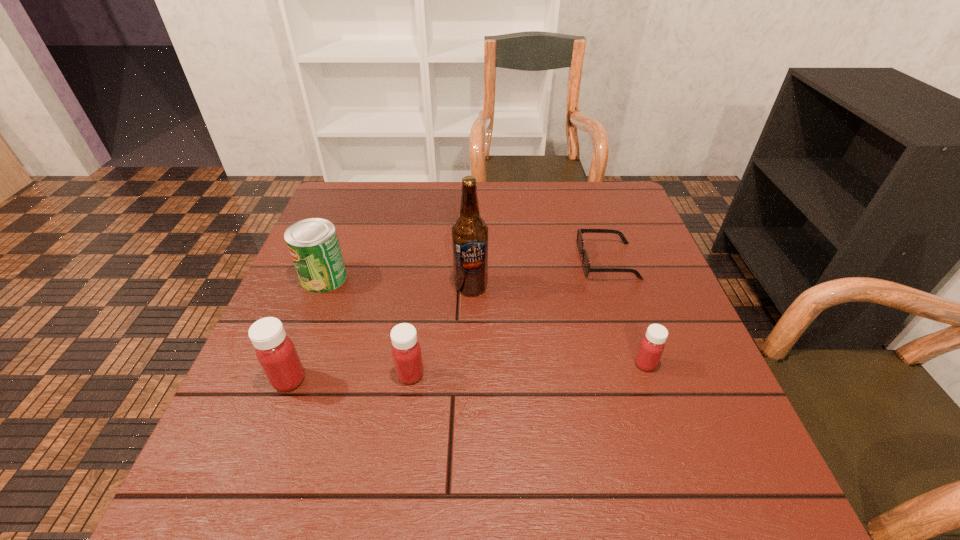
At what (x,y) coordinates should I click in order to perform the action: click on location for an additional medicine to make spacing equal. Please return your answer as a coordinate pair (x, y). Looking at the image, I should click on (529, 369).